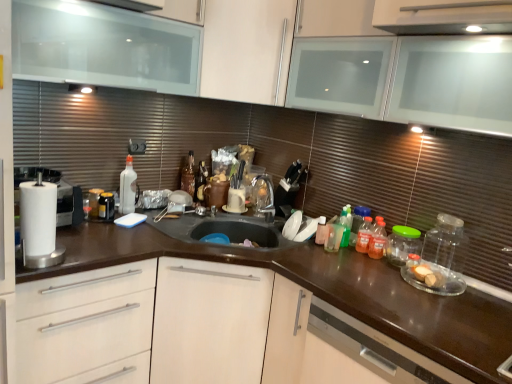
I want to click on vacant point to the left of translucent plastic bottle at center, so click(x=304, y=249).